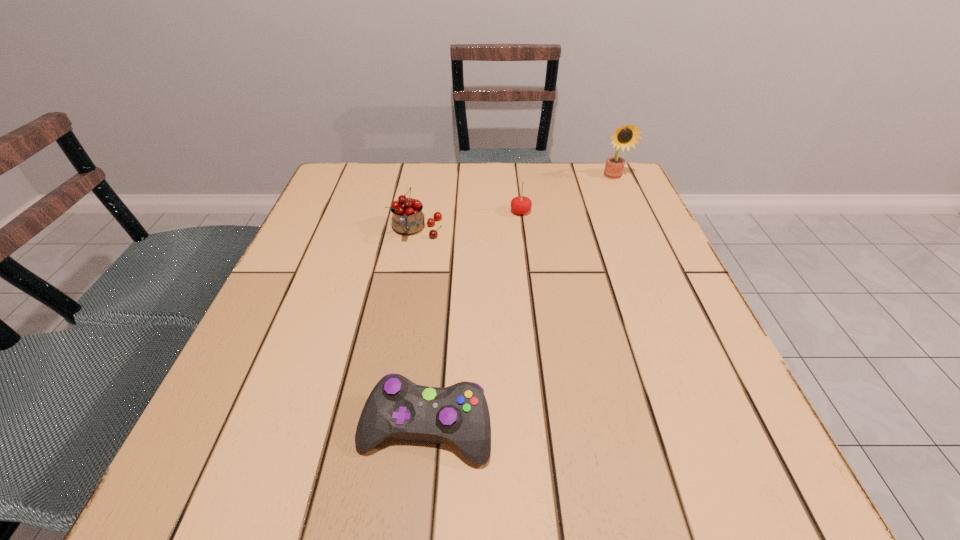
The image size is (960, 540). In order to click on unoccupied position between the left cherry and the second object from right to left in this screenshot , I will do `click(468, 221)`.

Where is `vacant area that lies between the shorter cherry and the farthest object`? vacant area that lies between the shorter cherry and the farthest object is located at coordinates (567, 194).

In order to click on free space that is in between the control and the third shortest object in this screenshot , I will do `click(421, 329)`.

This screenshot has height=540, width=960. What are the coordinates of `the second closest object to the control` in the screenshot? It's located at (521, 205).

Locate which object is the closest to the second object from right to left. Please provide its 2D coordinates. Your answer should be formatted as a tuple, i.e. [(x, y)], where the tuple contains the x and y coordinates of a point satisfying the conditions above.

[(407, 217)]

This screenshot has width=960, height=540. Find the location of `free space that satisfies the following two spatial constraints: 1. on the handle side of the third shortest object; 2. on the right side of the control`. free space that satisfies the following two spatial constraints: 1. on the handle side of the third shortest object; 2. on the right side of the control is located at coordinates (381, 428).